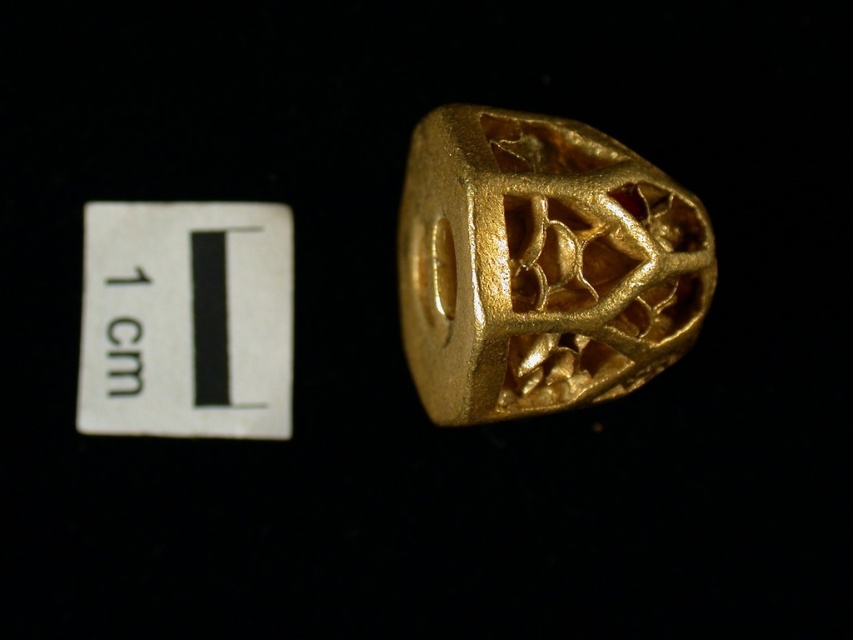
Question: Does gold matte ring at center have a larger size compared to white paper at upper left?

Choices:
 (A) no
 (B) yes

Answer: (B)

Question: Which point is closer to the camera taking this photo?

Choices:
 (A) pos(123,260)
 (B) pos(514,120)

Answer: (B)

Question: Which object appears farthest from the camera in this image?

Choices:
 (A) gold matte ring at center
 (B) white paper at upper left

Answer: (B)

Question: Which of the following is the closest to the observer?

Choices:
 (A) [x=639, y=276]
 (B) [x=291, y=241]

Answer: (A)

Question: Can you confirm if gold matte ring at center is bigger than white paper at upper left?

Choices:
 (A) yes
 (B) no

Answer: (A)

Question: Is gold matte ring at center thinner than white paper at upper left?

Choices:
 (A) yes
 (B) no

Answer: (B)